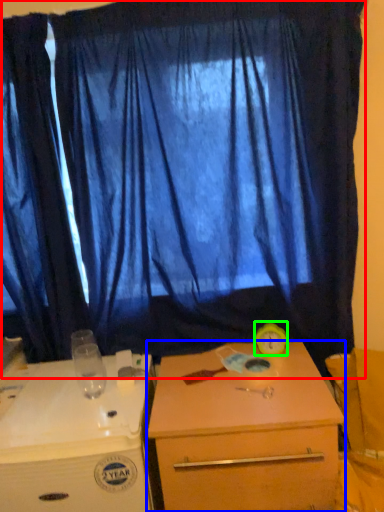
Question: Which object is positioned farthest from curtain (highlighted by a red box)? Select from desk (highlighted by a blue box) and alarm clock (highlighted by a green box).

Choices:
 (A) desk
 (B) alarm clock

Answer: (B)